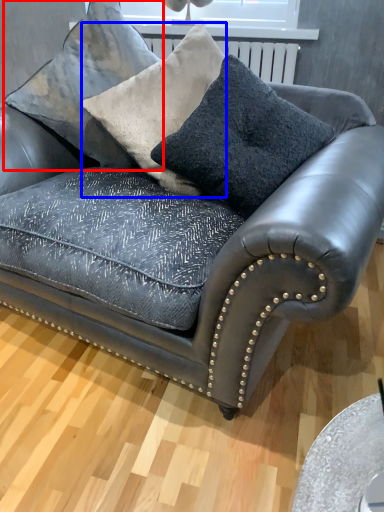
Question: Which object is closer to the camera taking this photo, pillow (highlighted by a red box) or throw pillow (highlighted by a blue box)?

Choices:
 (A) pillow
 (B) throw pillow

Answer: (B)